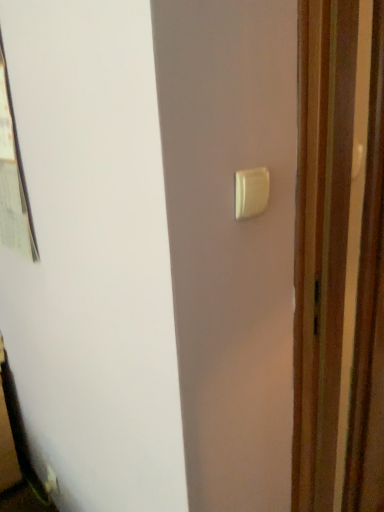
You are a GUI agent. You are given a task and a screenshot of the screen. Output one action in this format:
    pyautogui.click(x=<x>, y=<y>)
    Task: Click on the white plastic door handle at upper right
    Image resolution: width=384 pixels, height=512 pixels.
    Given the screenshot: What is the action you would take?
    pyautogui.click(x=251, y=192)

What do you see at coordinates (251, 192) in the screenshot? I see `white plastic door handle at upper right` at bounding box center [251, 192].

You are a GUI agent. You are given a task and a screenshot of the screen. Output one action in this format:
    pyautogui.click(x=<x>, y=<y>)
    Task: Click on the white plastic door handle at upper right
    Image resolution: width=384 pixels, height=512 pixels.
    Given the screenshot: What is the action you would take?
    pyautogui.click(x=251, y=192)